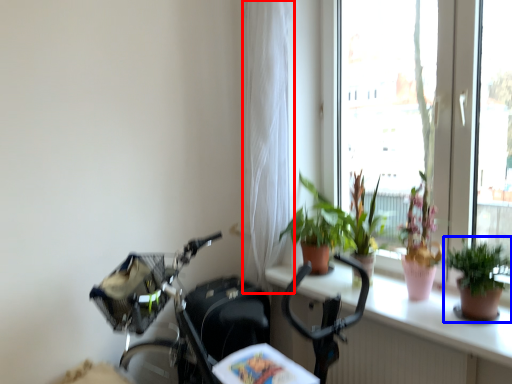
Question: Which object appears farthest to the camera in this image, curtain (highlighted by a red box) or houseplant (highlighted by a blue box)?

Choices:
 (A) curtain
 (B) houseplant

Answer: (A)